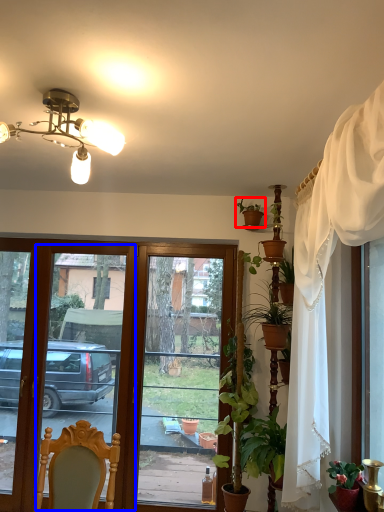
Question: Which point is further to the camera, houseplant (highlighted by a red box) or screen door (highlighted by a blue box)?

Choices:
 (A) houseplant
 (B) screen door

Answer: (B)